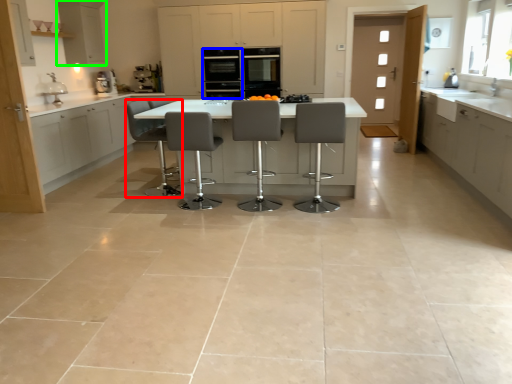
Question: Which is nearer to the chair (highlighted by a red box)? appliance (highlighted by a blue box) or cabinetry (highlighted by a green box).

Choices:
 (A) appliance
 (B) cabinetry

Answer: (A)